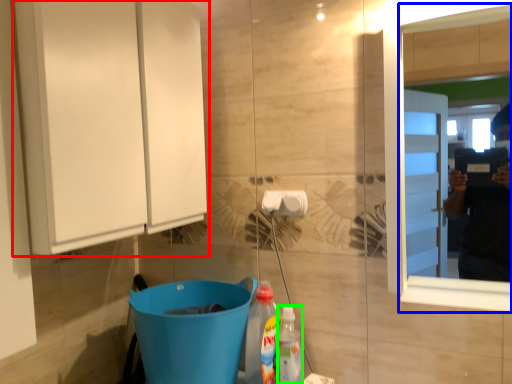
Question: Estimate the real-world distances between objects in this image. Which object is farther from cabinetry (highlighted by a red box), mirror (highlighted by a blue box) or cleaning product (highlighted by a green box)?

Choices:
 (A) mirror
 (B) cleaning product

Answer: (B)